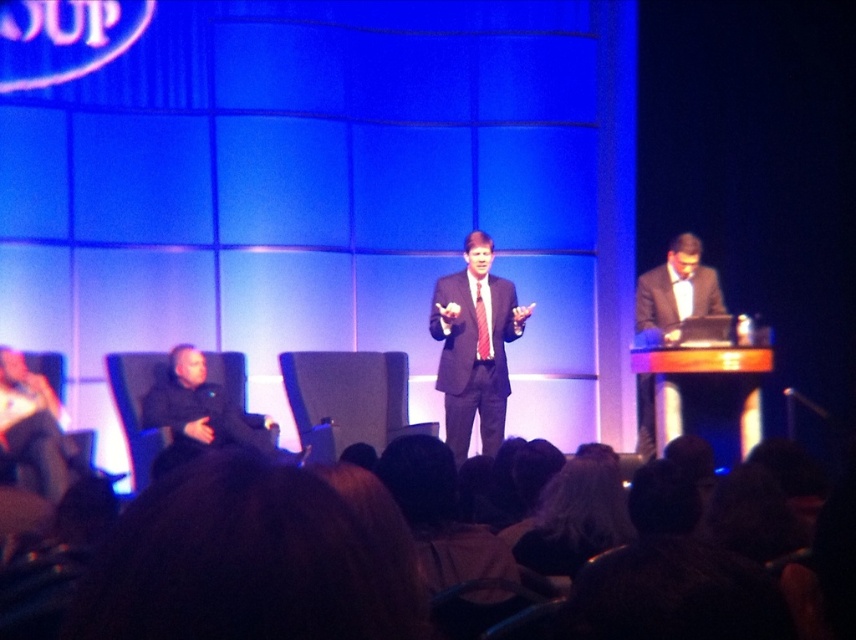
Based on the scene description, can you identify the object located at the coordinates point [224,566]?

The object at point [224,566] is brown hair at lower center.